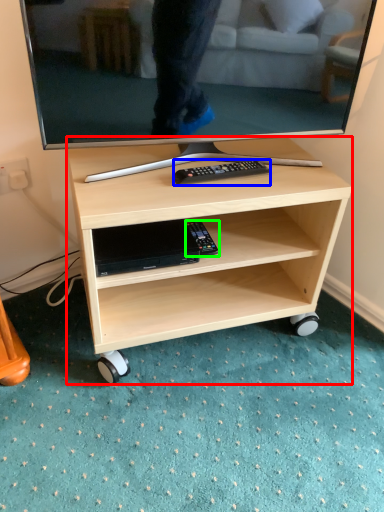
Question: Which object is positioned farthest from desk (highlighted by a red box)? Select from remote (highlighted by a blue box) and equipment (highlighted by a green box).

Choices:
 (A) remote
 (B) equipment

Answer: (A)